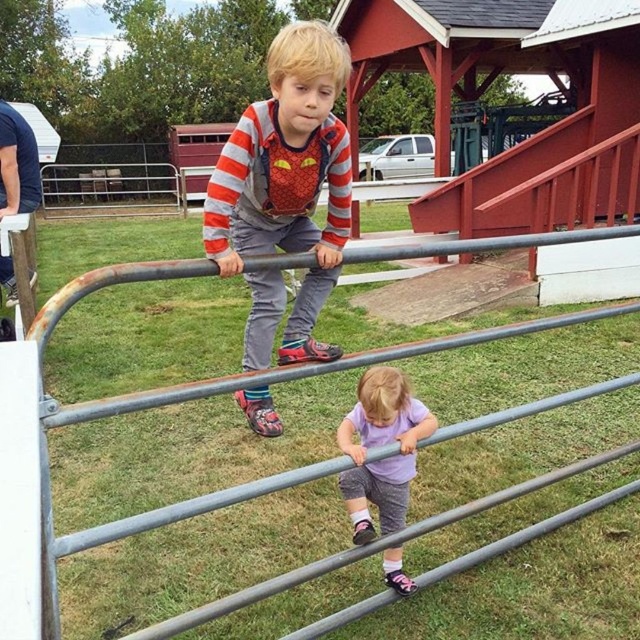
Question: Is matte gray overalls at center smaller than purple fabric shirt at lower center?

Choices:
 (A) yes
 (B) no

Answer: (A)

Question: Which object appears farthest from the camera in this image?

Choices:
 (A) purple fabric shirt at lower center
 (B) matte gray overalls at center

Answer: (A)

Question: Which point is farther to the camera?

Choices:
 (A) (323, 237)
 (B) (356, 429)

Answer: (B)

Question: Which point is farther to the camera?

Choices:
 (A) purple fabric shirt at lower center
 (B) matte gray overalls at center

Answer: (A)

Question: Is matte gray overalls at center positioned in front of purple fabric shirt at lower center?

Choices:
 (A) yes
 (B) no

Answer: (A)

Question: Does matte gray overalls at center appear over purple fabric shirt at lower center?

Choices:
 (A) yes
 (B) no

Answer: (A)